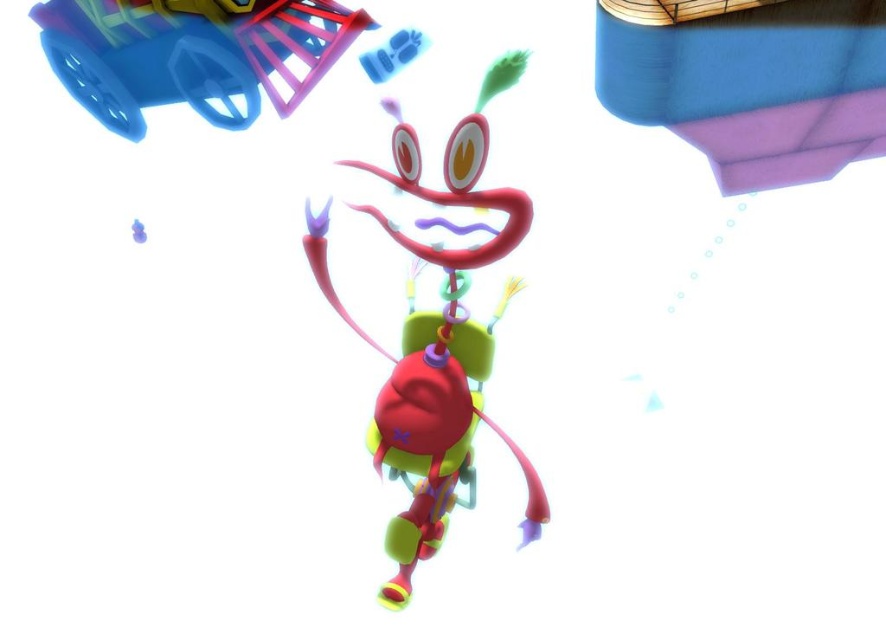
Question: Which is nearer to the glossy plastic toy at center?

Choices:
 (A) rubberized plastic wagon at upper left
 (B) matte blue fabric at upper right

Answer: (B)

Question: Does matte blue fabric at upper right have a smaller size compared to glossy plastic toy at center?

Choices:
 (A) yes
 (B) no

Answer: (A)

Question: Considering the relative positions of glossy plastic toy at center and rubberized plastic wagon at upper left in the image provided, where is glossy plastic toy at center located with respect to rubberized plastic wagon at upper left?

Choices:
 (A) right
 (B) left

Answer: (A)

Question: Among these points, which one is farthest from the camera?

Choices:
 (A) (459, 435)
 (B) (327, 52)

Answer: (B)

Question: Which object is the closest to the rubberized plastic wagon at upper left?

Choices:
 (A) glossy plastic toy at center
 (B) matte blue fabric at upper right

Answer: (A)

Question: Observing the image, what is the correct spatial positioning of glossy plastic toy at center in reference to rubberized plastic wagon at upper left?

Choices:
 (A) above
 (B) below

Answer: (B)